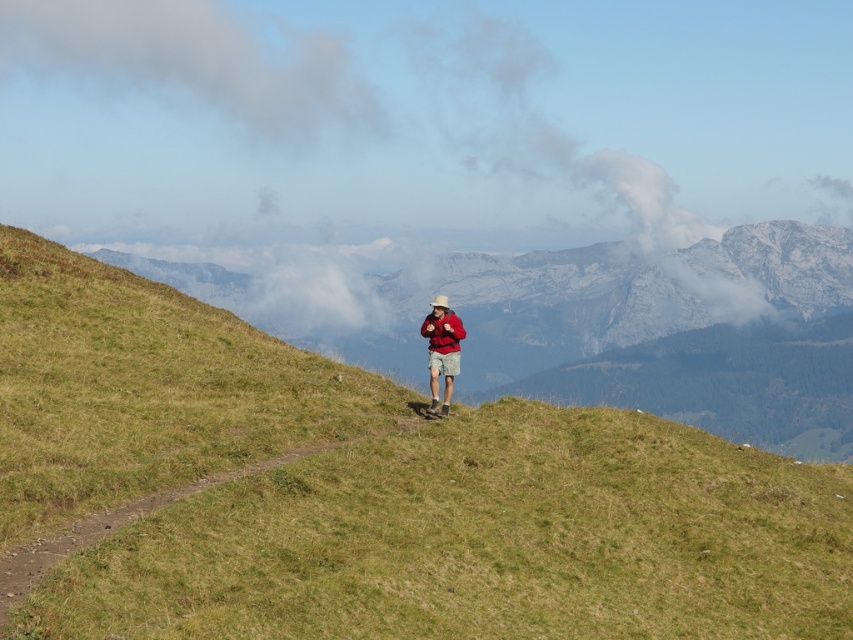
Question: Based on their relative distances, which object is farther from the gray cotton cloud at upper left?

Choices:
 (A) matte red jacket at center
 (B) green grassy hillside at center
 (C) brown dirt path at center

Answer: (C)

Question: Is green grassy hillside at center smaller than brown dirt path at center?

Choices:
 (A) yes
 (B) no

Answer: (B)

Question: Which point is farther to the camera?

Choices:
 (A) green grassy hillside at center
 (B) matte red jacket at center
 (C) gray cotton cloud at upper left

Answer: (C)

Question: Does gray cotton cloud at upper left appear on the right side of brown dirt path at center?

Choices:
 (A) no
 (B) yes

Answer: (A)

Question: Among these objects, which one is farthest from the camera?

Choices:
 (A) brown dirt path at center
 (B) gray cotton cloud at upper left
 (C) green grassy hillside at center
 (D) matte red jacket at center

Answer: (B)

Question: Can you confirm if green grassy hillside at center is smaller than matte red jacket at center?

Choices:
 (A) yes
 (B) no

Answer: (B)